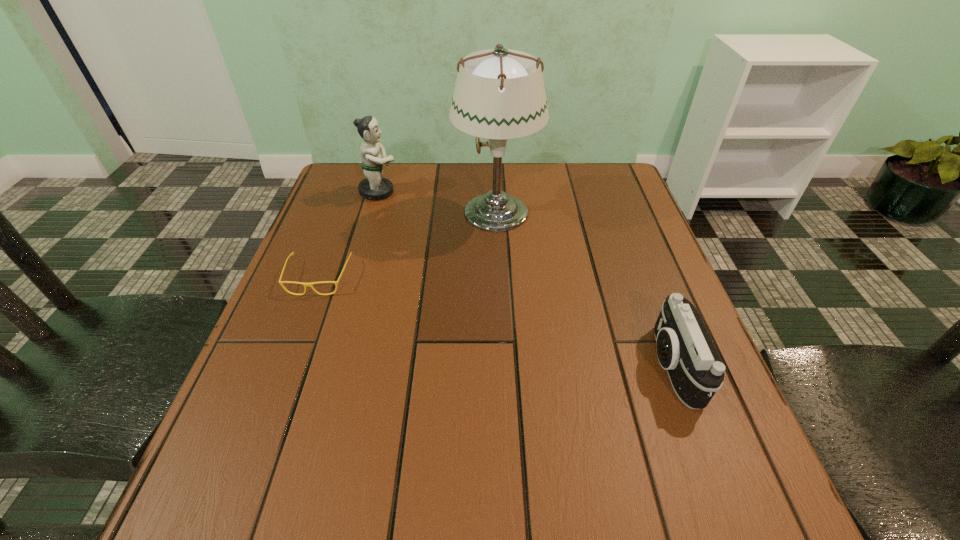
Identify the location of object situated at the far left corner. The image size is (960, 540). (374, 187).

Where is `vacant space at the far edge of the desktop`? The image size is (960, 540). vacant space at the far edge of the desktop is located at coordinates (413, 184).

In the image, there is a desktop. Where is `free region at the near edge`? The image size is (960, 540). free region at the near edge is located at coordinates (359, 527).

In the image, there is a desktop. Where is `vacant area at the left edge`? vacant area at the left edge is located at coordinates (329, 392).

In order to click on vacant area at the right edge in this screenshot , I will do `click(666, 294)`.

In the image, there is a desktop. Where is `vacant area at the far left corner`? vacant area at the far left corner is located at coordinates (357, 166).

Find the location of a particular element. The width and height of the screenshot is (960, 540). vacant space at the near right corner of the desktop is located at coordinates (770, 526).

Identify the location of empty space between the second shortest object and the second nearest object. This screenshot has height=540, width=960. (495, 322).

Locate an element on the screen. The image size is (960, 540). vacant space in between the shortest object and the lampshade is located at coordinates (407, 245).

Identify the location of unoccupied position between the third farthest object and the third object from left to right. This screenshot has height=540, width=960. (407, 245).